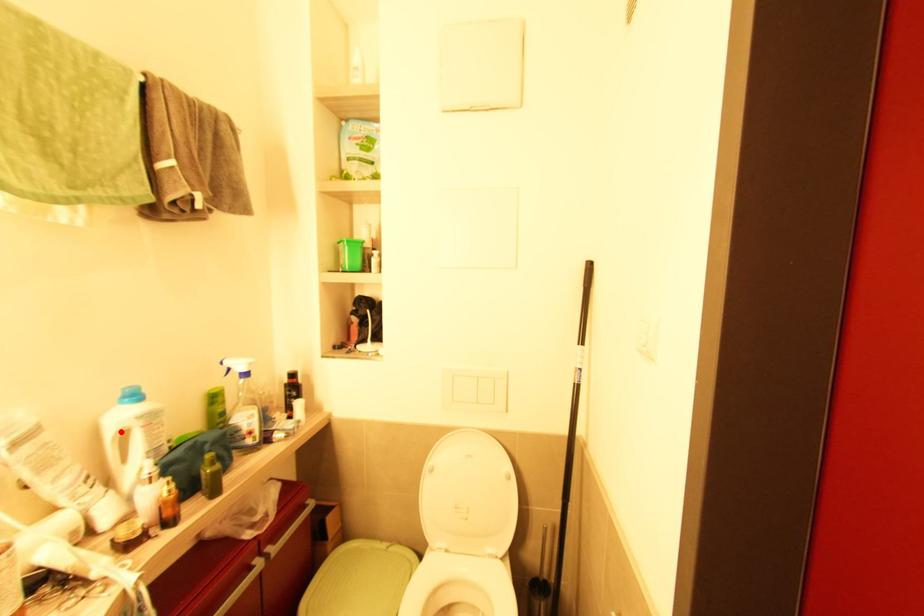
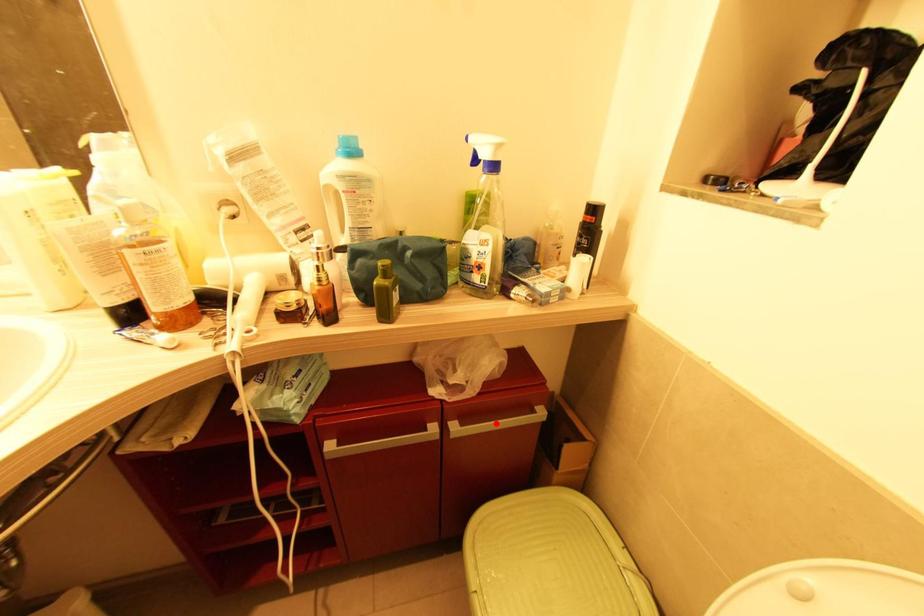
I am providing you with two images of the same scene from different viewpoints. A red point is marked on the first image and another point is marked on the second image. Is the marked point in image1 the same physical position as the marked point in image2?

No